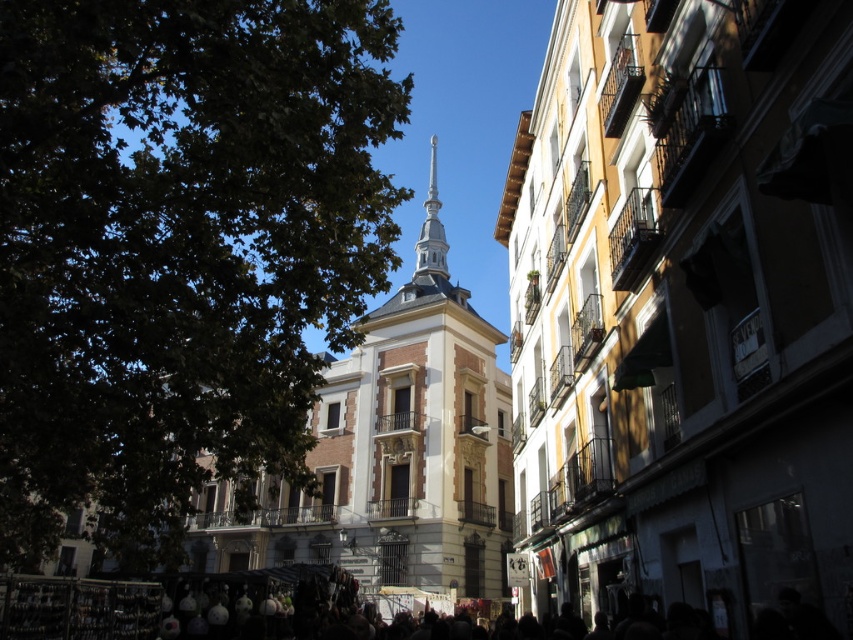
Based on the photo, you are standing in the middle of the street looking at the building with the tower. There are two points marked on the building. One is at coordinate point (x=27, y=232) and the other is at coordinate point (x=405, y=385). Which point is closer to you?

Point (x=27, y=232) is closer to the camera than point (x=405, y=385).

You are an architect analyzing a cityscape image. You need to determine the location of the green leafy tree at upper left in the image. What are its coordinates?

The green leafy tree at upper left is located at coordinates point (178,246).

You are standing at the center of the street looking towards the building with the tower. Can you see the green leafy tree at upper left from this position?

The green leafy tree at upper left is located at point (x=178, y=246), which is in the upper left area of the scene. Since you are standing at the center facing the building with the tower, the tree would be positioned to your left and above, so yes, you can see it from that position.